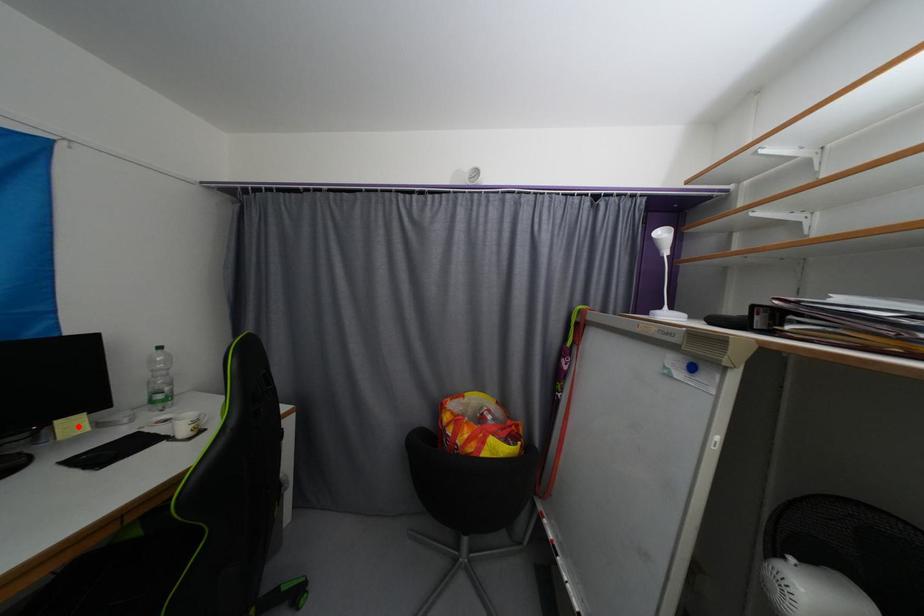
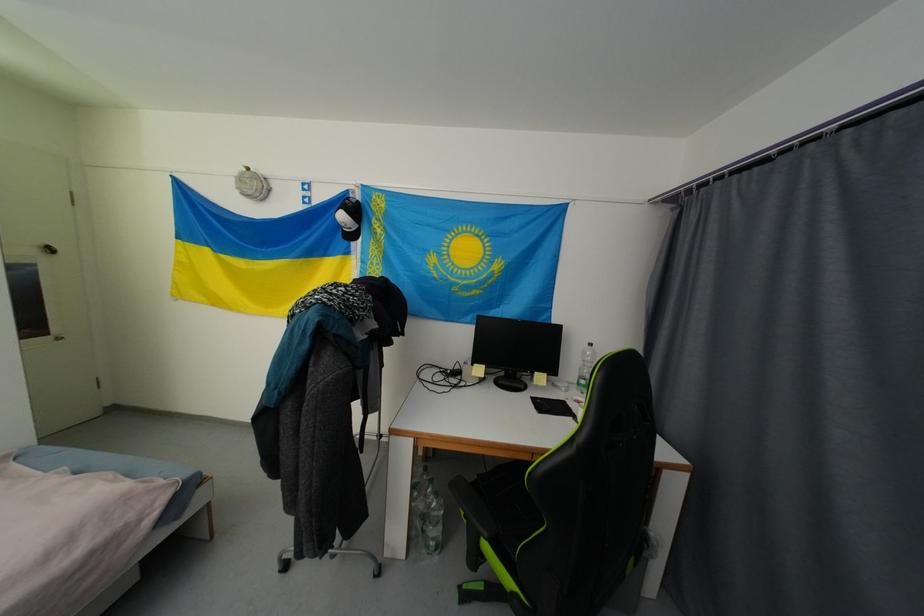
Question: A red point is marked in image1. In image2, is the corresponding 3D point closer to the camera or farther? Reply with the corresponding letter.

Choices:
 (A) The corresponding 3D point is closer.
 (B) The corresponding 3D point is farther.

Answer: (B)